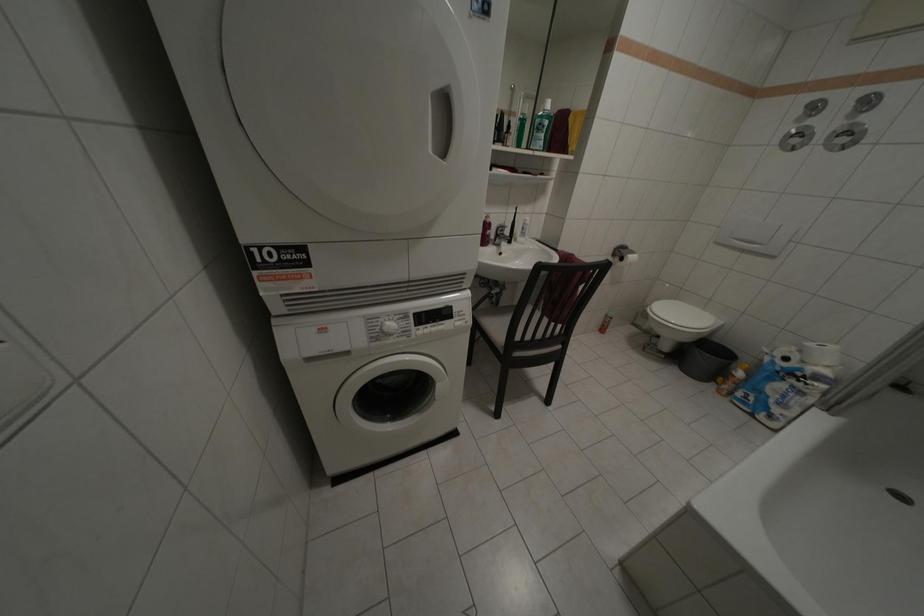
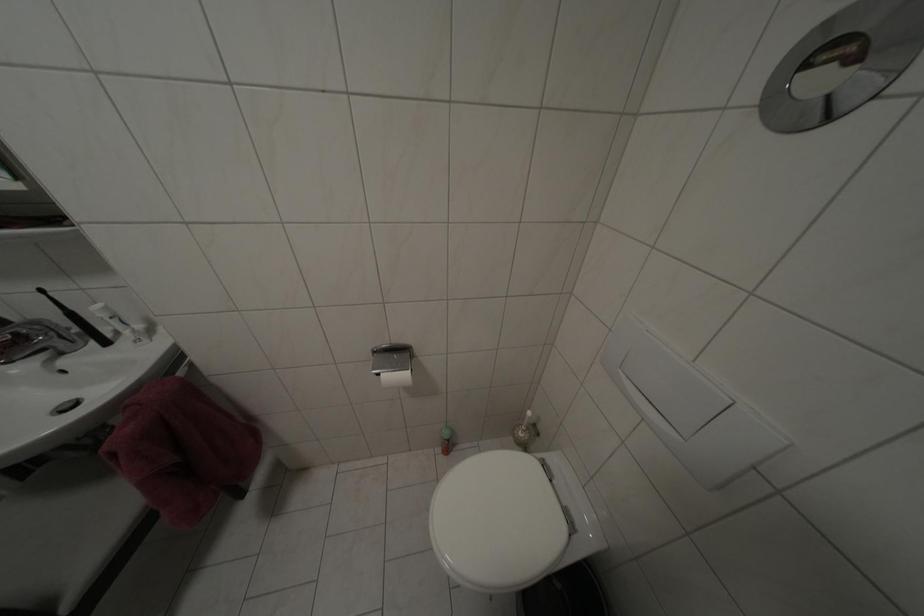
The images are taken continuously from a first-person perspective. In which direction are you moving?

The cameraman moved toward right, forward.